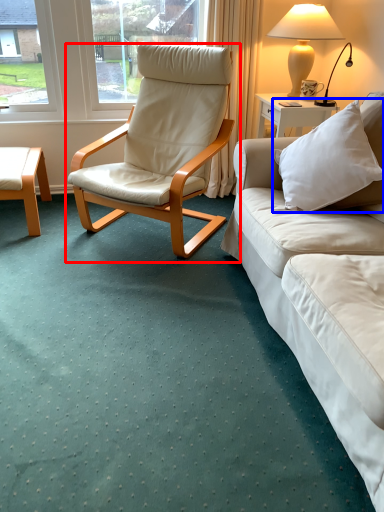
Question: Which of the following is the farthest to the observer, chair (highlighted by a red box) or pillow (highlighted by a blue box)?

Choices:
 (A) chair
 (B) pillow

Answer: (A)